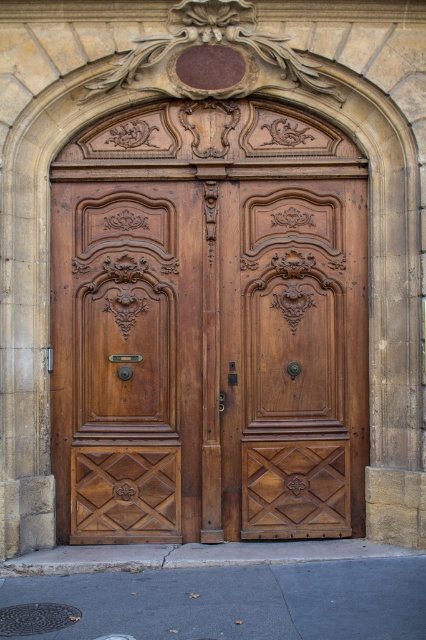
You are standing in front of two doors, the polished wood door at center and the matte wood door at center. Which door is nearer to you?

The polished wood door at center is closer to the viewer than the matte wood door at center, so the polished wood door at center is nearer to you.

You are standing in front of the doors and want to locate the polished wood door at center. What are its coordinates?

The polished wood door at center is located at coordinates point (126,358).